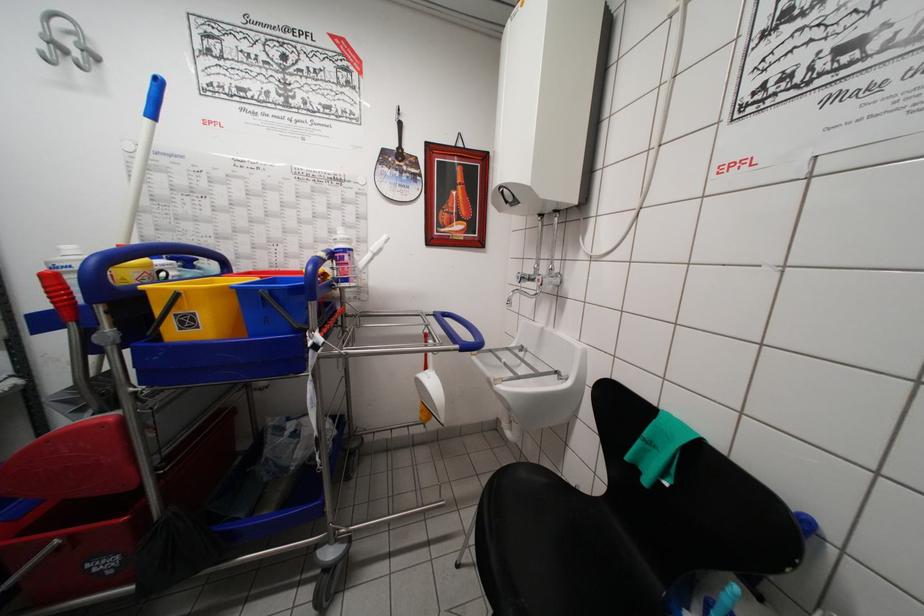
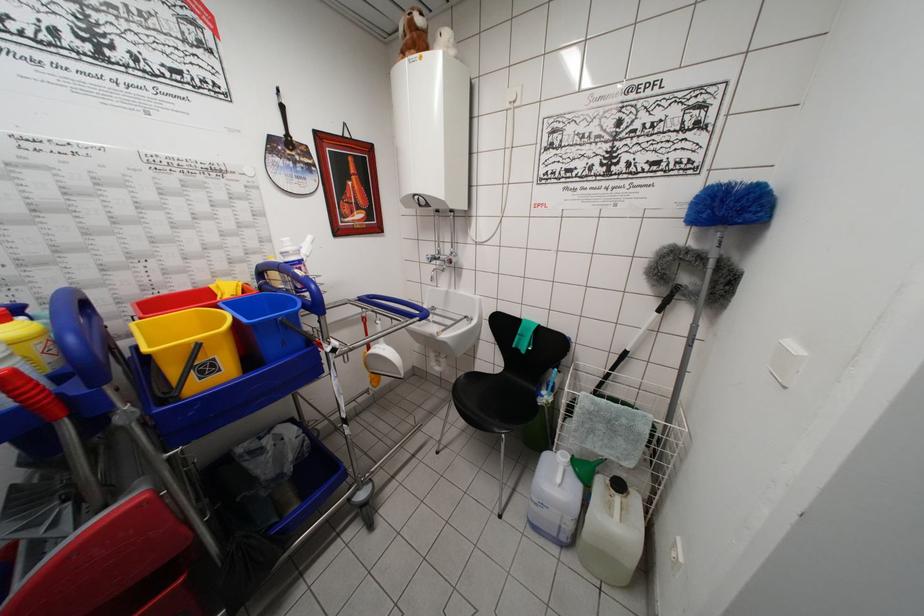
Where in the second image is the point corresponding to point (178, 297) from the first image?

(200, 349)